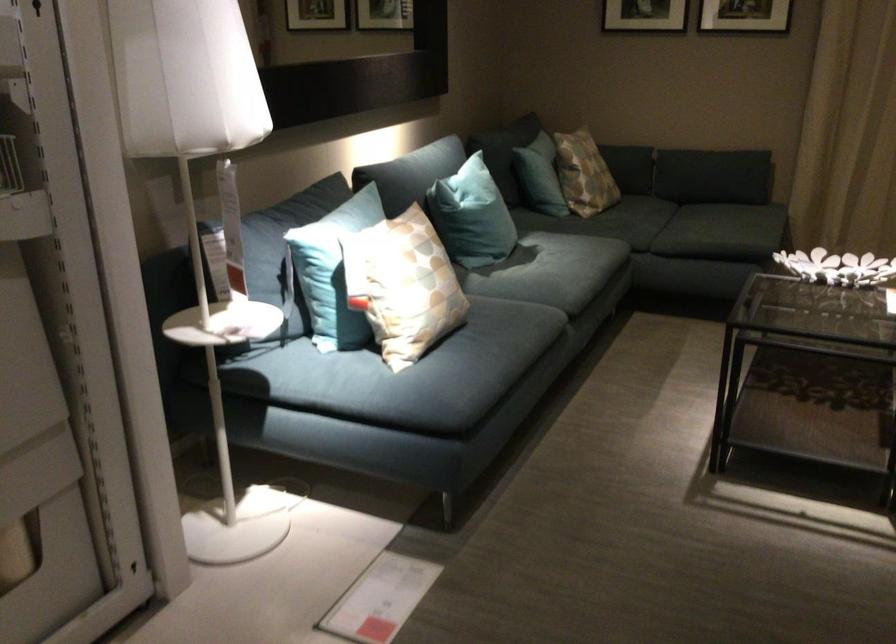
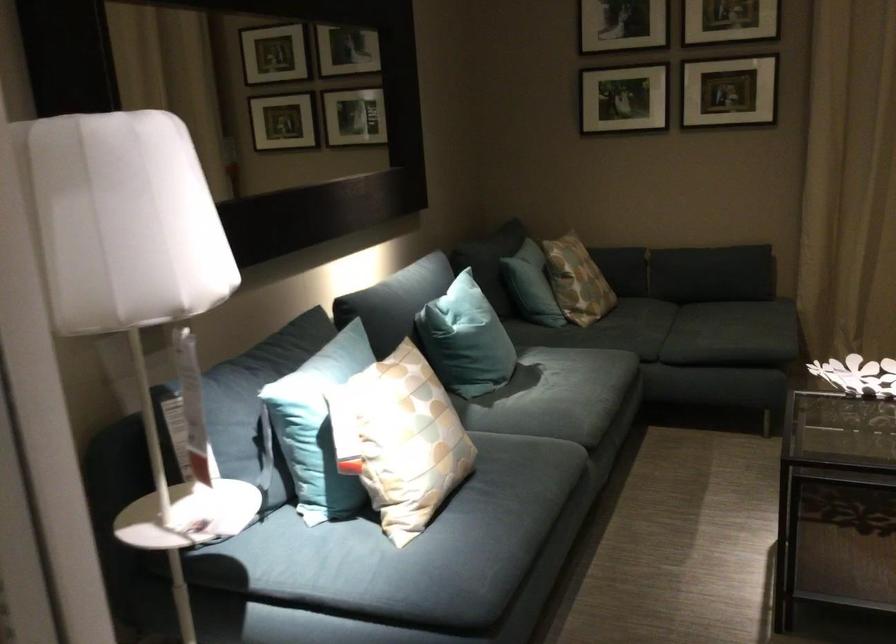
Question: Based on the continuous images, in which direction is the camera rotating? Reply with the corresponding letter.

Choices:
 (A) Left
 (B) Right
 (C) Up
 (D) Down

Answer: (C)